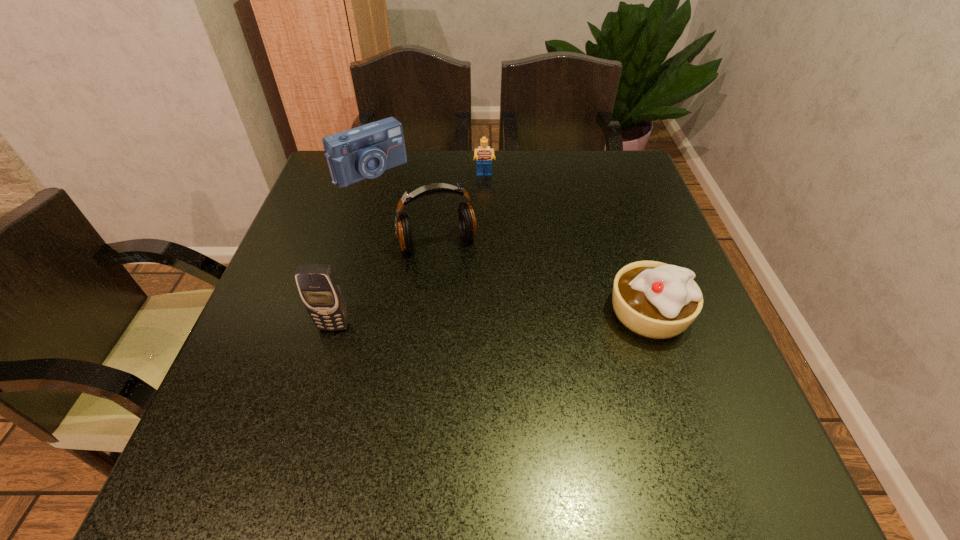
Locate an element on the screen. free spot on the desktop that is between the cellular telephone and the rightmost object and is positioned on the ear cups of the headset is located at coordinates [466, 321].

Identify the location of free space on the desktop that is between the cellular telephone and the rightmost object and is positioned on the face of the Lego. (492, 320).

You are a GUI agent. You are given a task and a screenshot of the screen. Output one action in this format:
    pyautogui.click(x=<x>, y=<y>)
    Task: Click on the free space on the desktop that is between the cellular telephone and the rightmost object and is positioned on the lens of the camera
    
    Given the screenshot: What is the action you would take?
    pyautogui.click(x=520, y=318)